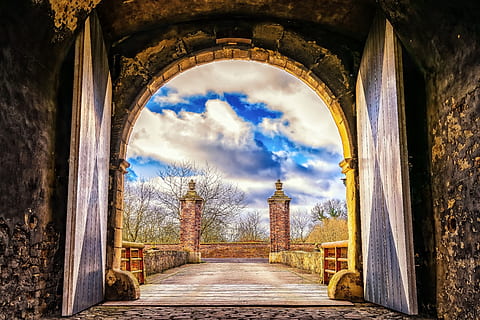
In order to click on brick pillar in this screenshot , I will do `click(186, 218)`.